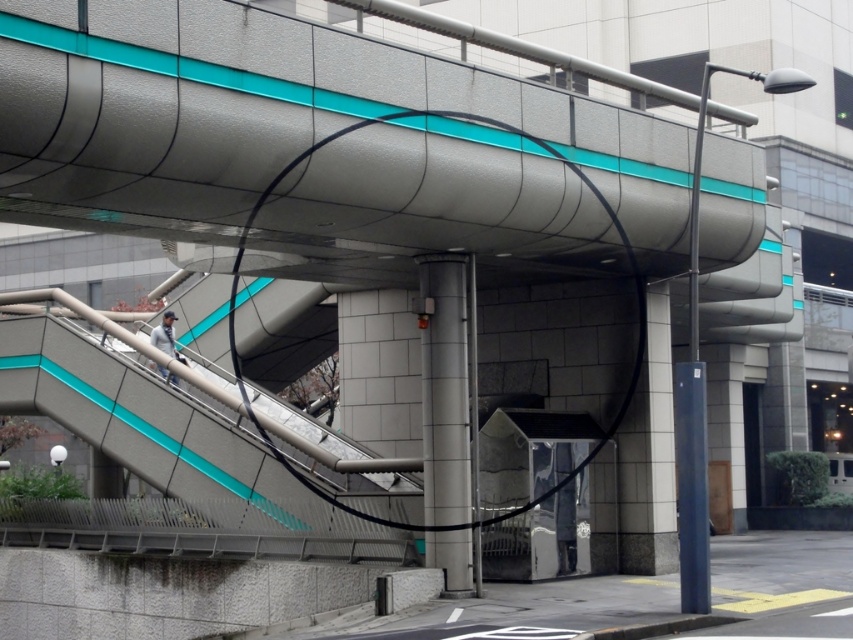
Question: Is metallic silver stairs at center closer to the viewer compared to satin silver pole at center?

Choices:
 (A) yes
 (B) no

Answer: (B)

Question: Which point is closer to the camera?

Choices:
 (A) (456, 515)
 (B) (181, 449)

Answer: (A)

Question: Does metallic silver stairs at center appear under satin silver pole at center?

Choices:
 (A) yes
 (B) no

Answer: (B)

Question: Is metallic silver stairs at center to the left of satin silver pole at center from the viewer's perspective?

Choices:
 (A) yes
 (B) no

Answer: (A)

Question: Which point appears closest to the camera in this image?

Choices:
 (A) (465, 266)
 (B) (115, 429)

Answer: (A)